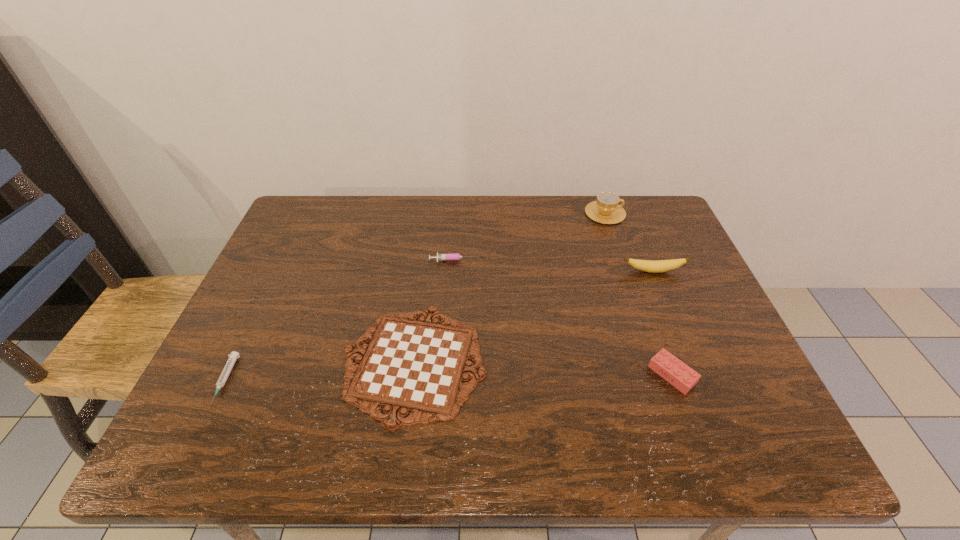
You are a GUI agent. You are given a task and a screenshot of the screen. Output one action in this format:
    pyautogui.click(x=<x>, y=<y>)
    Task: Click on the object that is at the far right corner
    Image resolution: width=960 pixels, height=540 pixels.
    Given the screenshot: What is the action you would take?
    pyautogui.click(x=606, y=210)

Find the location of a particular element. This screenshot has height=540, width=960. blank space at the far edge of the desktop is located at coordinates (390, 218).

Identify the location of vacant space at the near edge of the desktop. (541, 447).

In order to click on blank area at the left edge in this screenshot , I will do `click(256, 383)`.

The image size is (960, 540). I want to click on free space at the right edge, so click(x=651, y=257).

Identify the location of vacant area at the far left corner of the desktop. The width and height of the screenshot is (960, 540). (349, 195).

In the image, there is a desktop. Identify the location of vacant space at the far right corner. Image resolution: width=960 pixels, height=540 pixels. (638, 223).

Locate an element on the screen. empty location between the shorter syringe and the farther syringe is located at coordinates (340, 320).

This screenshot has width=960, height=540. Identify the location of empty space between the third shortest object and the third farthest object. (554, 266).

At what (x,y) coordinates should I click in order to perform the action: click on free space between the Lego and the farther syringe. Please return your answer as a coordinate pair (x, y). This screenshot has height=540, width=960. Looking at the image, I should click on (564, 318).